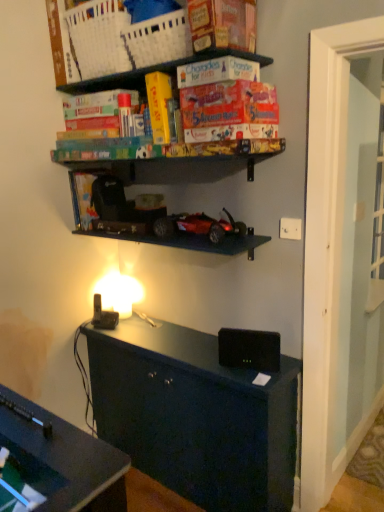
What is the approximate height of shiny red plastic toy car at center?

shiny red plastic toy car at center is 12.08 centimeters in height.

Where is `white plastic basket at upper center`? The width and height of the screenshot is (384, 512). white plastic basket at upper center is located at coordinates (98, 38).

This screenshot has width=384, height=512. In order to click on shiny red plastic toy car at center in this screenshot , I will do `click(198, 226)`.

In the scene shown: From a real-world perspective, is orange matte board game at upper center positioned above or below shiny red plastic toy car at center?

orange matte board game at upper center is above shiny red plastic toy car at center.

How different are the orientations of orange matte board game at upper center and shiny red plastic toy car at center in degrees?

0.019 degrees separate the facing orientations of orange matte board game at upper center and shiny red plastic toy car at center.

Considering the points (266, 126) and (240, 225), which point is behind, point (266, 126) or point (240, 225)?

The point (240, 225) is more distant.

Is orange matte board game at upper center far from shiny red plastic toy car at center?

No.

From a real-world perspective, is orange matte board game at upper center below white plastic electric outlet at upper right?

No, from a real-world perspective, orange matte board game at upper center is not under white plastic electric outlet at upper right.

How far apart are orange matte board game at upper center and white plastic electric outlet at upper right?

A distance of 19.58 inches exists between orange matte board game at upper center and white plastic electric outlet at upper right.

Is orange matte board game at upper center positioned with its back to white plastic electric outlet at upper right?

No, orange matte board game at upper center's orientation is not away from white plastic electric outlet at upper right.

Based on the photo, is orange matte board game at upper center taller than white plastic electric outlet at upper right?

Indeed, orange matte board game at upper center has a greater height compared to white plastic electric outlet at upper right.

Considering the sizes of objects white plastic electric outlet at upper right and black matte speaker at center in the image provided, who is taller, white plastic electric outlet at upper right or black matte speaker at center?

black matte speaker at center is taller.

Identify the location of speaker on the left side of white plastic electric outlet at upper right. (249, 349).

Which is behind, point (282, 233) or point (222, 346)?

The point (222, 346) is behind.

Is white plastic electric outlet at upper right facing away from white plastic basket at upper center?

white plastic electric outlet at upper right is not turned away from white plastic basket at upper center.

Who is shorter, white plastic electric outlet at upper right or white plastic basket at upper center?

white plastic electric outlet at upper right is shorter.

Considering the relative positions of white plastic electric outlet at upper right and white plastic basket at upper center in the image provided, is white plastic electric outlet at upper right to the left of white plastic basket at upper center from the viewer's perspective?

No, white plastic electric outlet at upper right is not to the left of white plastic basket at upper center.

Does white plastic electric outlet at upper right have a greater width compared to shiny red plastic toy car at center?

Incorrect, the width of white plastic electric outlet at upper right does not surpass that of shiny red plastic toy car at center.

How distant is white plastic electric outlet at upper right from shiny red plastic toy car at center?

white plastic electric outlet at upper right and shiny red plastic toy car at center are 13.17 inches apart.

Is the position of white plastic electric outlet at upper right less distant than that of shiny red plastic toy car at center?

That is False.

Is white plastic electric outlet at upper right at the right side of shiny red plastic toy car at center?

Yes.

From the image's perspective, is shiny red plastic toy car at center under white plastic electric outlet at upper right?

No, from the image's perspective, shiny red plastic toy car at center is not beneath white plastic electric outlet at upper right.

Who is smaller, shiny red plastic toy car at center or white plastic electric outlet at upper right?

white plastic electric outlet at upper right is smaller.

Can you see shiny red plastic toy car at center touching white plastic electric outlet at upper right?

They are not placed beside each other.

Considering the relative sizes of white plastic basket at upper center and white plastic electric outlet at upper right in the image provided, is white plastic basket at upper center taller than white plastic electric outlet at upper right?

Yes.

Is white plastic basket at upper center looking in the opposite direction of white plastic electric outlet at upper right?

No, white plastic basket at upper center's orientation is not away from white plastic electric outlet at upper right.

Which is in front, point (91, 29) or point (300, 223)?

The point (300, 223) is closer to the camera.

Where is `model car that is on the left side of orange matte board game at upper center`? The height and width of the screenshot is (512, 384). model car that is on the left side of orange matte board game at upper center is located at coordinates (198, 226).

Locate an element on the screen. paperback book above the white plastic electric outlet at upper right (from a real-world perspective) is located at coordinates (229, 111).

Looking at the image, which one is located further to white plastic electric outlet at upper right, black matte speaker at center or orange matte board game at upper center?

orange matte board game at upper center.

Considering their positions, is white plastic basket at upper center positioned further to shiny red plastic toy car at center than white plastic electric outlet at upper right?

white plastic basket at upper center is positioned further to the anchor shiny red plastic toy car at center.

From the picture: When comparing their distances from orange matte board game at upper center, does black matte speaker at center or white plastic basket at upper center seem closer?

white plastic basket at upper center.

Estimate the real-world distances between objects in this image. Which object is further from white plastic basket at upper center, white plastic electric outlet at upper right or shiny red plastic toy car at center?

white plastic electric outlet at upper right is positioned further to the anchor white plastic basket at upper center.

Which object lies further to the anchor point orange matte board game at upper center, white plastic basket at upper center or white plastic electric outlet at upper right?

Based on the image, white plastic basket at upper center appears to be further to orange matte board game at upper center.

From the image, which object appears to be nearer to black matte speaker at center, orange matte board game at upper center or shiny red plastic toy car at center?

Among the two, shiny red plastic toy car at center is located nearer to black matte speaker at center.

Which object lies nearer to the anchor point white plastic basket at upper center, shiny red plastic toy car at center or orange matte board game at upper center?

orange matte board game at upper center lies closer to white plastic basket at upper center than the other object.

Based on their spatial positions, is black matte speaker at center or shiny red plastic toy car at center further from orange matte board game at upper center?

black matte speaker at center is positioned further to the anchor orange matte board game at upper center.

The width and height of the screenshot is (384, 512). Find the location of `electric outlet between orange matte board game at upper center and black matte speaker at center in the vertical direction`. electric outlet between orange matte board game at upper center and black matte speaker at center in the vertical direction is located at coordinates (290, 228).

Where is `paperback book between white plastic basket at upper center and white plastic electric outlet at upper right from top to bottom`? The image size is (384, 512). paperback book between white plastic basket at upper center and white plastic electric outlet at upper right from top to bottom is located at coordinates (229, 111).

Image resolution: width=384 pixels, height=512 pixels. What are the coordinates of `model car between orange matte board game at upper center and white plastic electric outlet at upper right in the up-down direction` in the screenshot? It's located at (198, 226).

I want to click on model car that lies between white plastic basket at upper center and black matte speaker at center from top to bottom, so click(x=198, y=226).